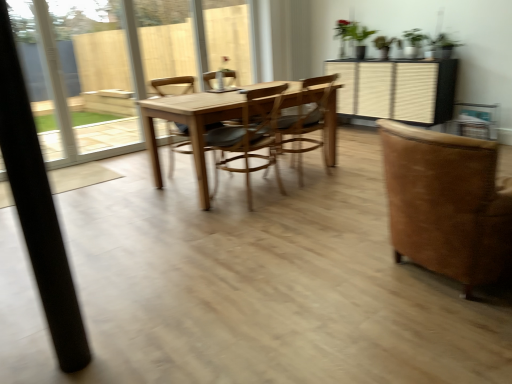
I want to click on free area in between wooden chair at center, which ranks as the 3th chair in left-to-right order, and black matte pole at left, so click(207, 249).